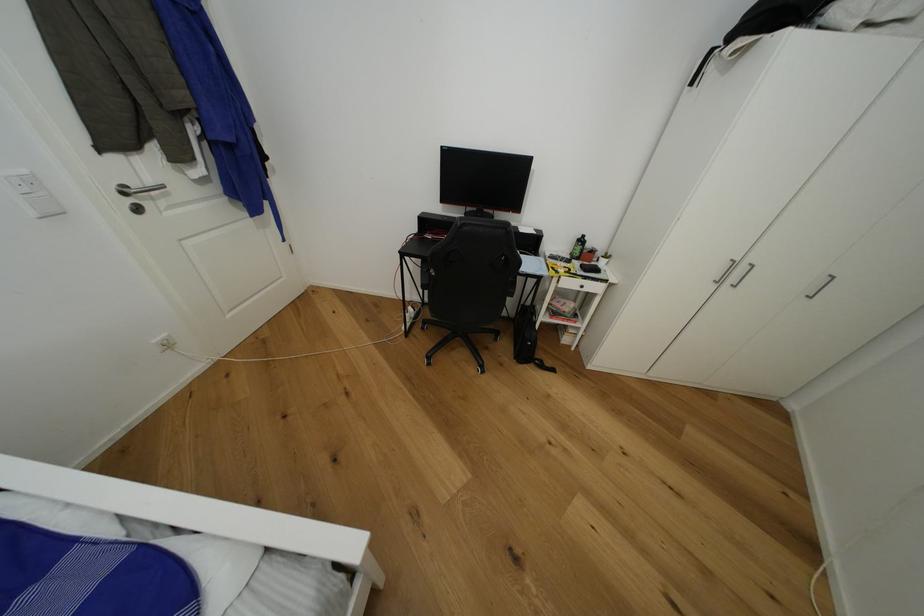
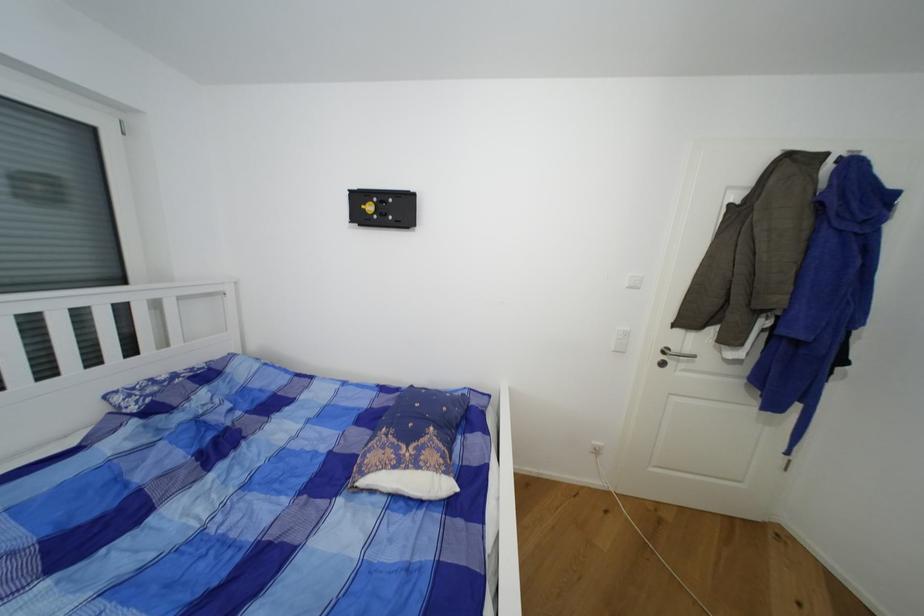
Locate, in the second image, the point that corresponds to point (40, 216) in the first image.

(617, 351)